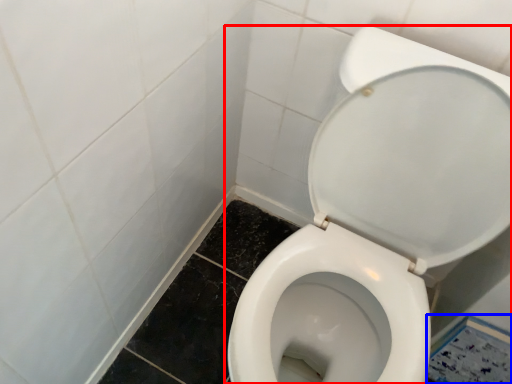
Question: Which point is closer to the camera, toilet (highlighted by a red box) or square (highlighted by a blue box)?

Choices:
 (A) toilet
 (B) square

Answer: (A)